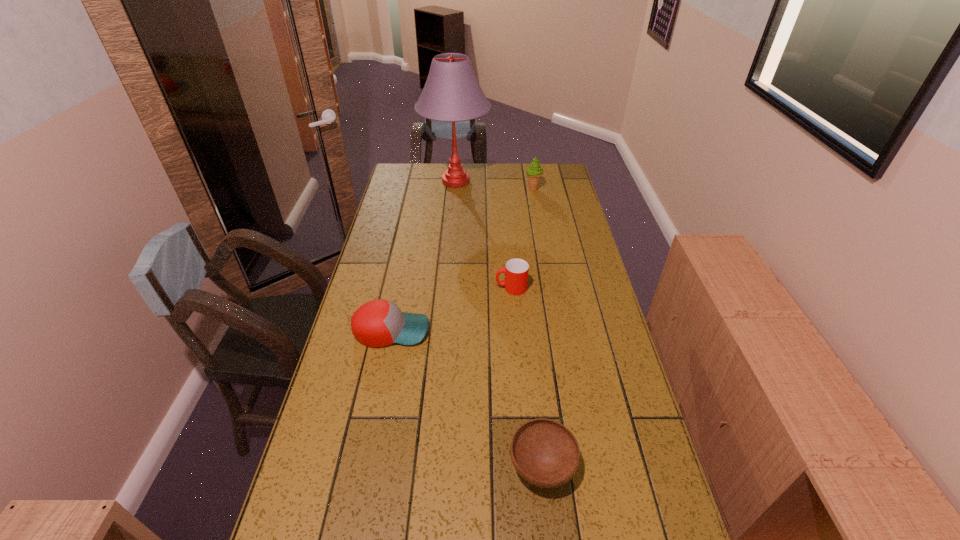
Where is `vacant region located at the brim of the second nearest object`? Image resolution: width=960 pixels, height=540 pixels. vacant region located at the brim of the second nearest object is located at coordinates (559, 330).

At what (x,y) coordinates should I click in order to perform the action: click on vacant space situated 0.180m on the left of the nearest object. Please return your answer as a coordinate pair (x, y). Looking at the image, I should click on (433, 467).

The image size is (960, 540). In order to click on table lamp that is at the far edge in this screenshot , I will do `click(452, 93)`.

I want to click on icecream located in the far edge section of the desktop, so click(534, 172).

You are a GUI agent. You are given a task and a screenshot of the screen. Output one action in this format:
    pyautogui.click(x=<x>, y=<y>)
    Task: Click on the table lamp that is at the left edge
    
    Given the screenshot: What is the action you would take?
    pyautogui.click(x=452, y=93)

Identify the location of baseball cap located at the left edge. (378, 323).

Where is `object present at the right edge`? object present at the right edge is located at coordinates click(x=534, y=172).

Identify the location of object that is at the far left corner. Image resolution: width=960 pixels, height=540 pixels. coord(452,93).

Locate an element on the screen. This screenshot has width=960, height=540. object positioned at the far right corner is located at coordinates (534, 172).

The height and width of the screenshot is (540, 960). Identify the location of vacant region at the far edge. (512, 177).